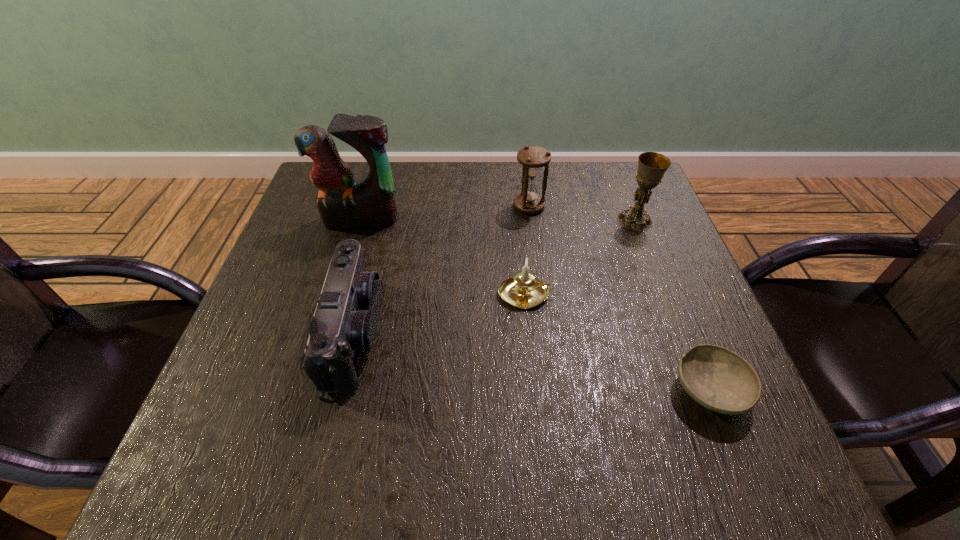
Where is `object located at the far left corner`? The width and height of the screenshot is (960, 540). object located at the far left corner is located at coordinates (342, 203).

Where is `object that is positioned at the far right corner`? This screenshot has height=540, width=960. object that is positioned at the far right corner is located at coordinates (652, 166).

At what (x,y) coordinates should I click in order to perform the action: click on object that is at the near right corner. Please return your answer as a coordinate pair (x, y). This screenshot has width=960, height=540. Looking at the image, I should click on (720, 380).

Where is `free region at the far edge of the desktop`? Image resolution: width=960 pixels, height=540 pixels. free region at the far edge of the desktop is located at coordinates (563, 172).

Locate an element on the screen. Image resolution: width=960 pixels, height=540 pixels. blank space at the left edge is located at coordinates (293, 329).

The width and height of the screenshot is (960, 540). What are the coordinates of `vacant region at the right edge of the desktop` in the screenshot? It's located at [x=642, y=254].

Where is `vacant space at the near left corner of the desktop`? vacant space at the near left corner of the desktop is located at coordinates (265, 437).

At what (x,y) coordinates should I click in order to perform the action: click on free location at the far right corner. Please return your answer as a coordinate pair (x, y). The width and height of the screenshot is (960, 540). Looking at the image, I should click on (633, 187).

The width and height of the screenshot is (960, 540). I want to click on vacant space that's between the fifth tallest object and the chalice, so click(x=581, y=257).

Where is `free space between the chalice and the shortest object`? free space between the chalice and the shortest object is located at coordinates (672, 305).